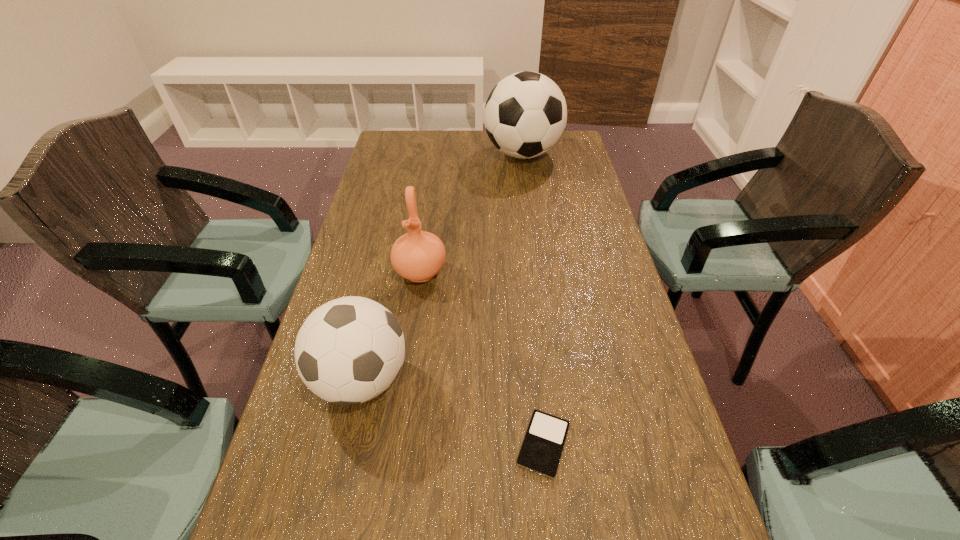
I want to click on the farther soccer ball, so click(x=525, y=115).

The height and width of the screenshot is (540, 960). I want to click on the taller soccer ball, so pyautogui.click(x=525, y=115).

Image resolution: width=960 pixels, height=540 pixels. In order to click on pottery in this screenshot , I will do `click(418, 256)`.

Where is `the left soccer ball`? This screenshot has height=540, width=960. the left soccer ball is located at coordinates (348, 351).

You are a GUI agent. You are given a task and a screenshot of the screen. Output one action in this format:
    pyautogui.click(x=<x>, y=<y>)
    Task: Click on the shorter soccer ball
    The width and height of the screenshot is (960, 540).
    Given the screenshot: What is the action you would take?
    pyautogui.click(x=348, y=351)

At what (x,y) coordinates should I click in order to perform the action: click on iPod. Please return your answer as a coordinate pair (x, y). The image size is (960, 540). Looking at the image, I should click on (541, 450).

Find the location of a particular element. Image resolution: width=960 pixels, height=540 pixels. free space located on the left of the right soccer ball is located at coordinates (391, 154).

This screenshot has height=540, width=960. In order to click on free space located on the spout of the third nearest object in this screenshot , I will do `click(415, 308)`.

This screenshot has width=960, height=540. I want to click on free spot located on the right of the nearer soccer ball, so click(581, 380).

The image size is (960, 540). I want to click on free region located on the back of the shortest object, so click(527, 290).